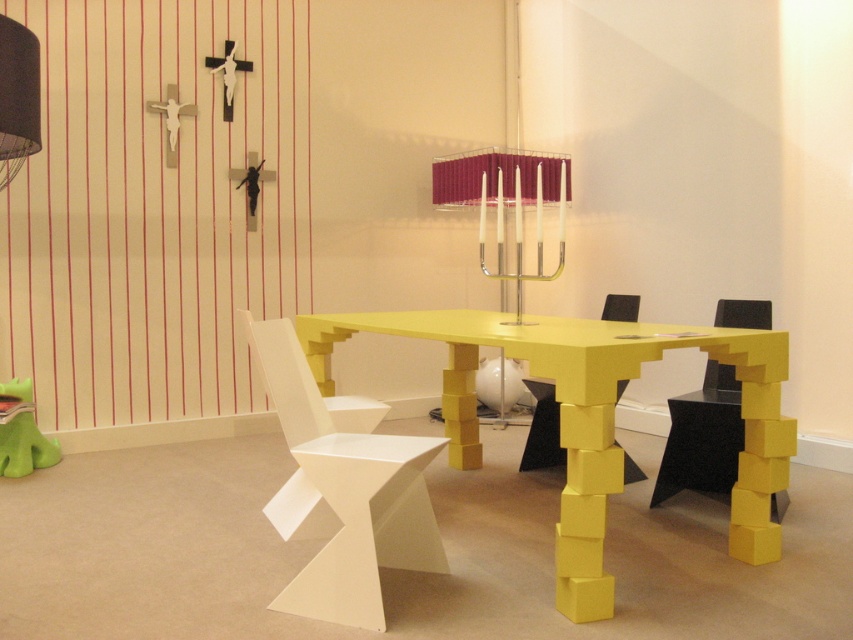
Where is the yellow matte table at center located in the image?

The yellow matte table at center is located at point (590, 417).

You are planning to host a dinner party and need to seat four guests. You have a white matte chair at center and a yellow matte chair at lower right. Which chair should you choose if you want to accommodate a guest who requires more seating space?

The white matte chair at center is bigger than the yellow matte chair at lower right, so you should choose the white matte chair at center to accommodate the guest who needs more seating space.